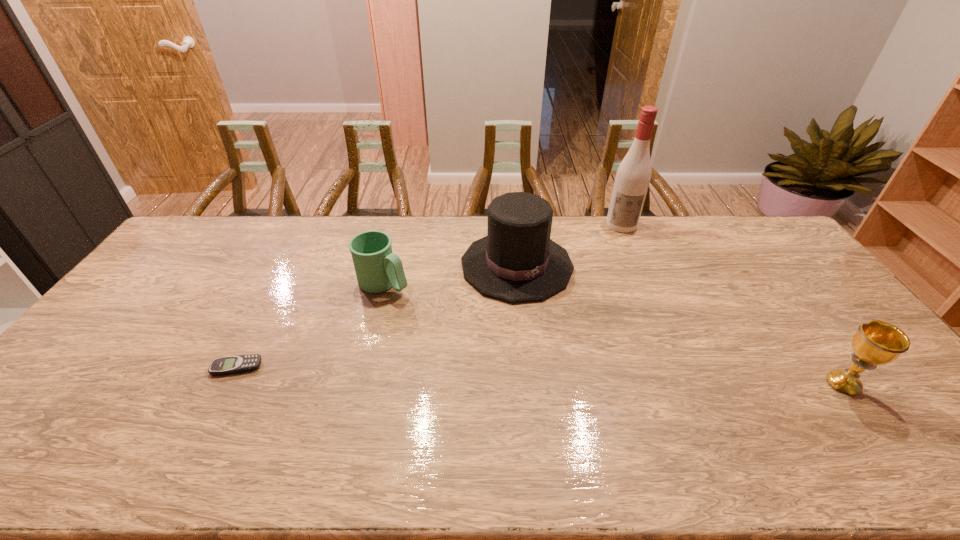
Choose which object is the second nearest neighbor to the mug. Please provide its 2D coordinates. Your answer should be formatted as a tuple, i.e. [(x, y)], where the tuple contains the x and y coordinates of a point satisfying the conditions above.

[(241, 363)]

Where is `the second closest object to the dress hat`? This screenshot has width=960, height=540. the second closest object to the dress hat is located at coordinates (633, 176).

The height and width of the screenshot is (540, 960). Identify the location of free space in the image that satisfies the following two spatial constraints: 1. on the front side of the chalice; 2. on the right side of the fourth object from left to right. (689, 384).

Locate an element on the screen. The width and height of the screenshot is (960, 540). vacant space that satisfies the following two spatial constraints: 1. on the back side of the tallest object; 2. on the right side of the shortest object is located at coordinates (309, 225).

Image resolution: width=960 pixels, height=540 pixels. In order to click on vacant space that satisfies the following two spatial constraints: 1. on the back side of the shortest object; 2. on the left side of the mug in this screenshot , I will do point(279,284).